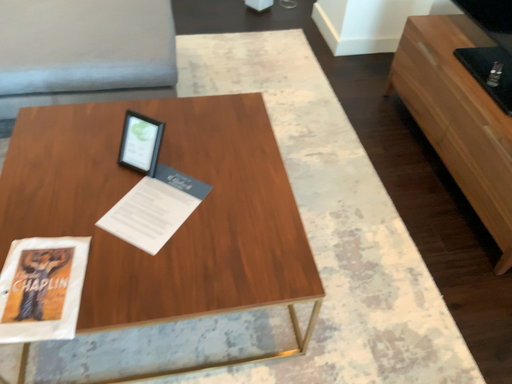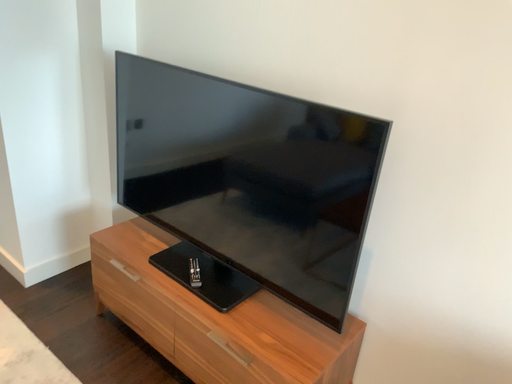
Question: Which way did the camera rotate in the video?

Choices:
 (A) rotated downward
 (B) rotated upward

Answer: (B)